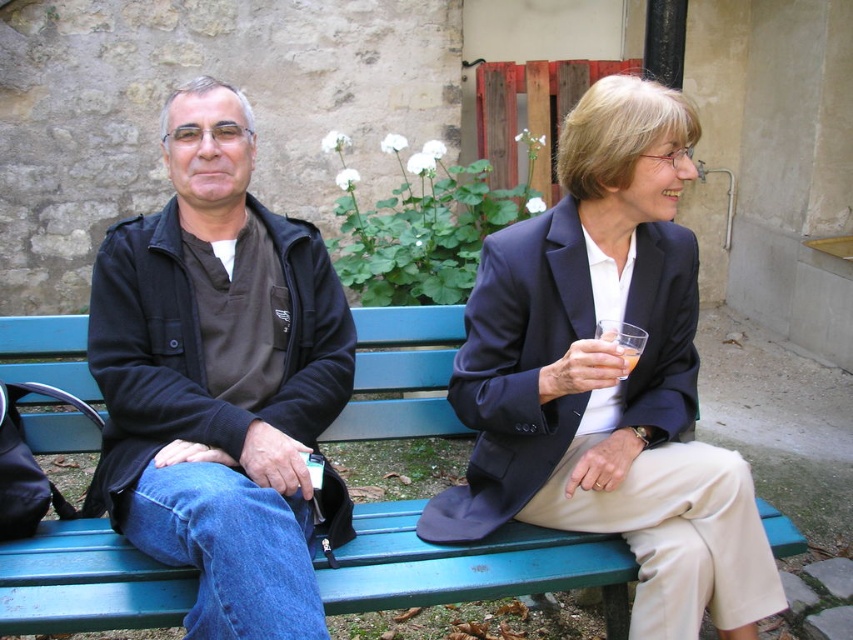
You are a photographer setting up a shoot at the location shown. You need to place a small light source on the green painted wood bench at center so it illuminates the matte black blazer at center. Based on their positions, where should you place the light source on the bench to best light the blazer?

The matte black blazer at center is positioned on the right side of the green painted wood bench at center. To best illuminate the blazer, place the light source on the right side of the green painted wood bench at center, closest to where the blazer is located.

You are designing a new outdoor seating area and want to ensure that the dark blue jacket at left and the green painted wood bench at center will fit comfortably. Given that the bench is 1.5 meters wide, what is the minimum width required for the seating area to accommodate both items without overlapping?

The dark blue jacket at left is larger than the green painted wood bench at center. Since the bench is 1.5 meters wide, the minimum width needed would be greater than 1.5 meters to accommodate the larger jacket size.

You are standing in front of the scene and want to know the position of the dark blue jacket at left relative to the woman on the right. Can you determine if it is to the left or right of her?

The dark blue jacket at left is located at point (x=218, y=378), which is to the left of the woman on the right.